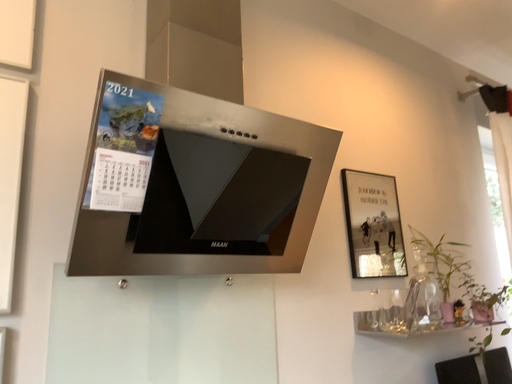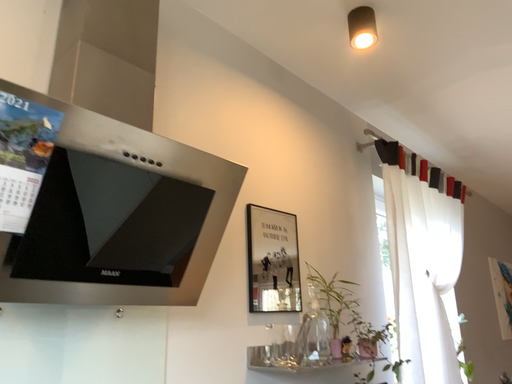
Question: How did the camera likely rotate when shooting the video?

Choices:
 (A) rotated right
 (B) rotated left

Answer: (A)